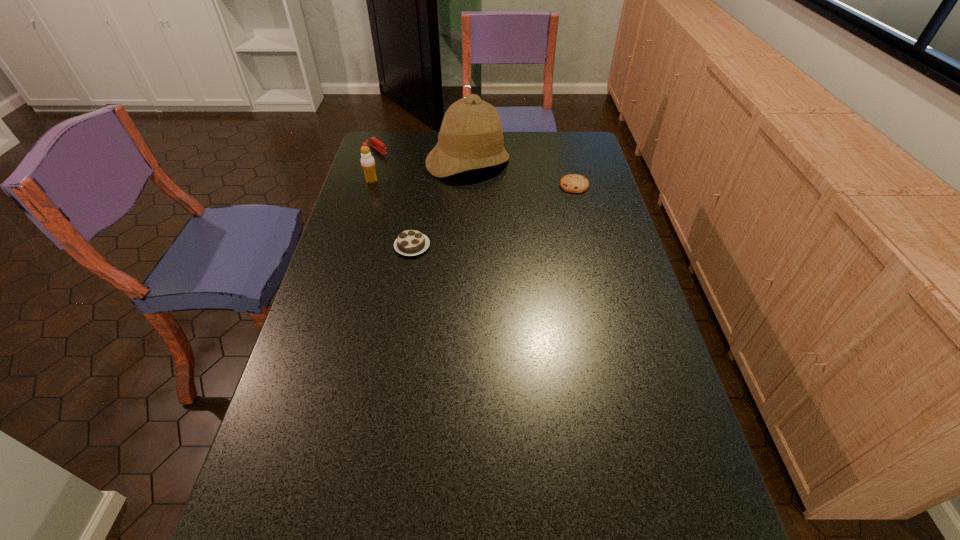
The height and width of the screenshot is (540, 960). Find the location of `the nearest object`. the nearest object is located at coordinates (410, 242).

The height and width of the screenshot is (540, 960). What are the coordinates of `the shortest object` in the screenshot? It's located at (573, 183).

Where is `the rightmost object`? the rightmost object is located at coordinates (573, 183).

Locate an element on the screen. stapler is located at coordinates (373, 141).

What are the coordinates of `hat` in the screenshot? It's located at (471, 137).

At what (x,y) coordinates should I click in order to perform the action: click on icecream. Please return your answer as a coordinate pair (x, y). Looking at the image, I should click on (367, 161).

The height and width of the screenshot is (540, 960). I want to click on vacant position located 0.110m on the left of the nearest object, so click(x=360, y=246).

Where is `free space located 0.270m on the left of the shortest object`? This screenshot has width=960, height=540. free space located 0.270m on the left of the shortest object is located at coordinates (486, 185).

Locate an element on the screen. The width and height of the screenshot is (960, 540). vacant region located 0.360m on the front-facing side of the stapler is located at coordinates (438, 194).

At what (x,y) coordinates should I click in order to perform the action: click on free space located 0.310m on the front-facing side of the stapler. Please return your answer as a coordinate pair (x, y). This screenshot has height=540, width=960. Looking at the image, I should click on (430, 187).